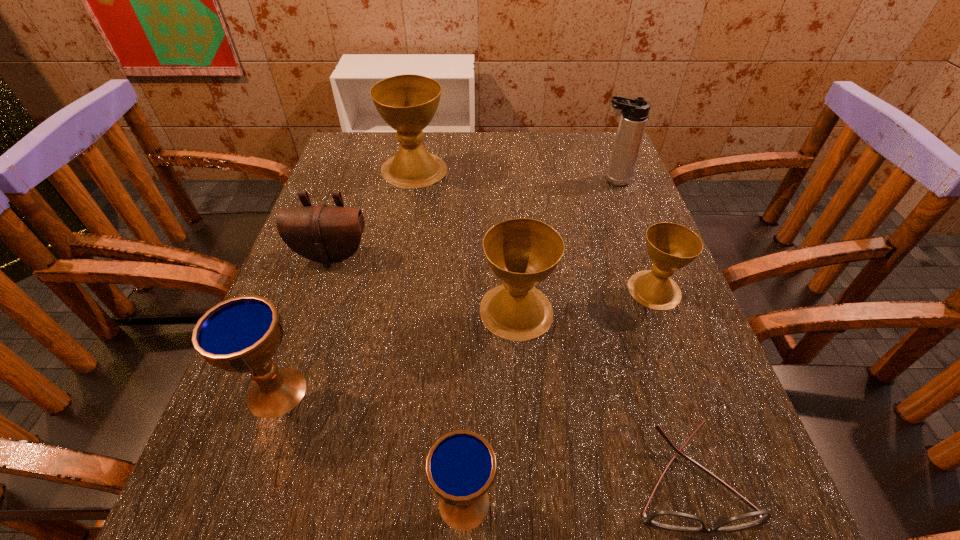
Find the location of `the tallest chalice`. the tallest chalice is located at coordinates (407, 103).

In order to click on the farthest chalice in this screenshot , I will do `click(407, 103)`.

Locate an element on the screen. thermos bottle is located at coordinates (634, 112).

You are a GUI agent. You are given a task and a screenshot of the screen. Output one action in this format:
    pyautogui.click(x=<x>, y=<y>)
    Task: Click on the second smallest brown chalice
    
    Given the screenshot: What is the action you would take?
    click(x=522, y=252)

Where is `the bigger blue chalice`? This screenshot has height=540, width=960. the bigger blue chalice is located at coordinates click(x=241, y=334).

Locate an element on the screen. The height and width of the screenshot is (540, 960). the farther blue chalice is located at coordinates (241, 334).

In order to click on pouch in this screenshot , I will do `click(324, 234)`.

You are a GUI agent. You are given a task and a screenshot of the screen. Output one action in this format:
    pyautogui.click(x=<x>, y=<y>)
    Task: Click on the third farthest object
    The height and width of the screenshot is (540, 960).
    Given the screenshot: What is the action you would take?
    pyautogui.click(x=324, y=234)

This screenshot has height=540, width=960. In order to click on the smallest brown chalice in this screenshot , I will do click(670, 246).

Identify the location of the rightmost brown chalice. (670, 246).